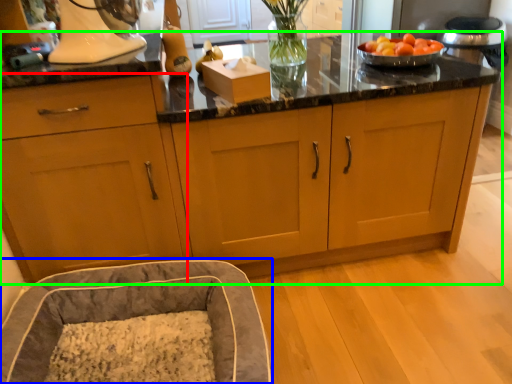
Question: Based on their relative distances, which object is nearer to cabinetry (highlighted by a red box)? Choose from bean bag chair (highlighted by a blue box) and cabinetry (highlighted by a green box).

Choices:
 (A) bean bag chair
 (B) cabinetry

Answer: (B)